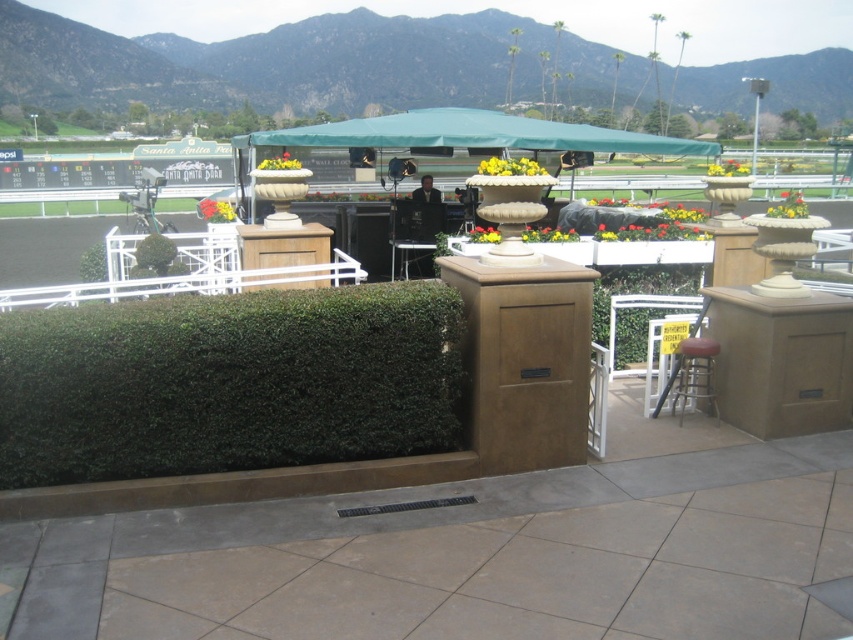
You are a photographer positioned at the edge of the racetrack at Santa Anita Park. You need to set up your equipment between the metallic silver chair at center and the metallic silver stool at lower right. Which object should you place your equipment closer to if you want it nearer to the camera?

You should place your equipment closer to the metallic silver chair at center because it is closer to the viewer compared to the metallic silver stool at lower right.

You are sitting on the metallic silver chair at center and want to place a small potted plant on the green textured hedge at center. Is the hedge below the chair, making this possible?

Yes, the green textured hedge at center is located below the metallic silver chair at center, so placing the potted plant on the hedge is possible.

You are attending an event at Santa Anita Park and need to sit down. There are two options available, the metallic silver chair at center and the metallic silver stool at lower right. Which one is positioned to the left of the other?

The metallic silver chair at center is to the left of the metallic silver stool at lower right.